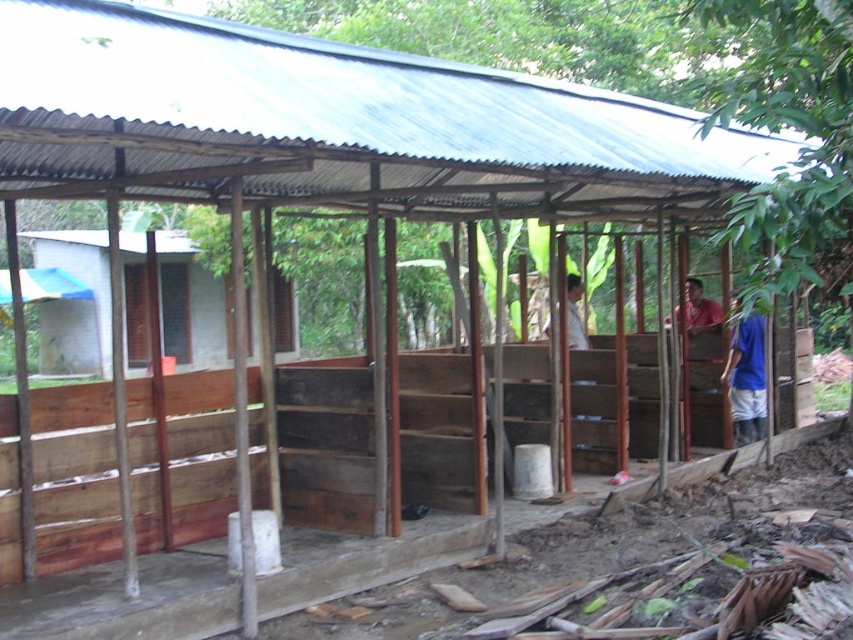
Where is the blue fabric shirt at right located in the scene?

The blue fabric shirt at right is located at point (747, 380) in the scene.

You are standing inside the rustic structure and see the red shirt at right and the blue fabric shirt at right. Which shirt is closer to you?

The red shirt at right is closer to you because it is further to the viewer than the blue fabric shirt at right.